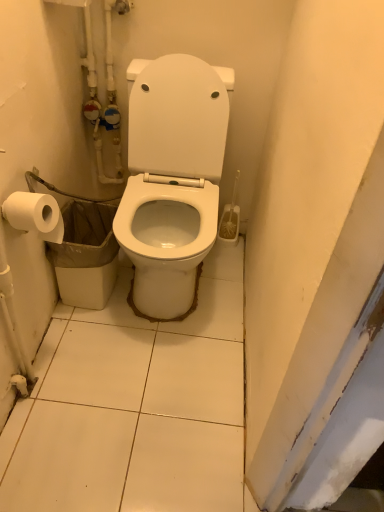
Question: Considering the relative sizes of white glossy toilet at center and white matte toilet paper at left in the image provided, is white glossy toilet at center bigger than white matte toilet paper at left?

Choices:
 (A) yes
 (B) no

Answer: (A)

Question: From a real-world perspective, is white glossy toilet at center over white matte toilet paper at left?

Choices:
 (A) no
 (B) yes

Answer: (A)

Question: Are white glossy toilet at center and white matte toilet paper at left beside each other?

Choices:
 (A) no
 (B) yes

Answer: (A)

Question: Is white glossy toilet at center not close to white matte toilet paper at left?

Choices:
 (A) yes
 (B) no

Answer: (B)

Question: Is white glossy toilet at center smaller than white matte toilet paper at left?

Choices:
 (A) no
 (B) yes

Answer: (A)

Question: Does point (200, 72) appear closer or farther from the camera than point (54, 216)?

Choices:
 (A) farther
 (B) closer

Answer: (A)

Question: In the image, is white glossy toilet at center positioned in front of or behind white matte toilet paper at left?

Choices:
 (A) front
 (B) behind

Answer: (A)

Question: From the image's perspective, is white glossy toilet at center positioned above or below white matte toilet paper at left?

Choices:
 (A) below
 (B) above

Answer: (B)

Question: Is white glossy toilet at center situated inside white matte toilet paper at left or outside?

Choices:
 (A) inside
 (B) outside

Answer: (B)

Question: Do you think white matte toilet paper at left is within white glossy toilet at center, or outside of it?

Choices:
 (A) outside
 (B) inside

Answer: (A)

Question: From the image's perspective, is white matte toilet paper at left above or below white glossy toilet at center?

Choices:
 (A) above
 (B) below

Answer: (B)

Question: Does point (26, 230) appear closer or farther from the camera than point (178, 198)?

Choices:
 (A) closer
 (B) farther

Answer: (A)

Question: From their relative heights in the image, would you say white matte toilet paper at left is taller or shorter than white glossy toilet at center?

Choices:
 (A) short
 (B) tall

Answer: (A)

Question: Based on their positions, is white glossy toilet at center located to the left or right of white plastic trash can at lower left?

Choices:
 (A) right
 (B) left

Answer: (A)

Question: From a real-world perspective, is white glossy toilet at center above or below white plastic trash can at lower left?

Choices:
 (A) below
 (B) above

Answer: (B)